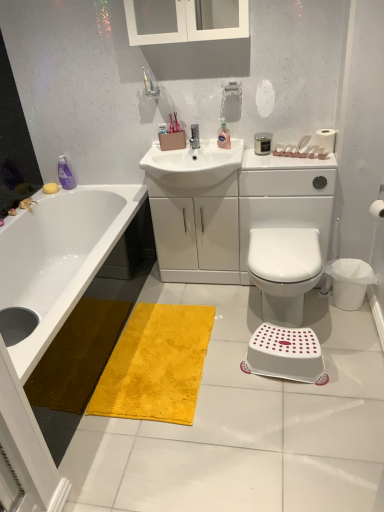
Identify the location of empty space that is ontop of white plastic bidet at center (from a real-world perspective). (292, 246).